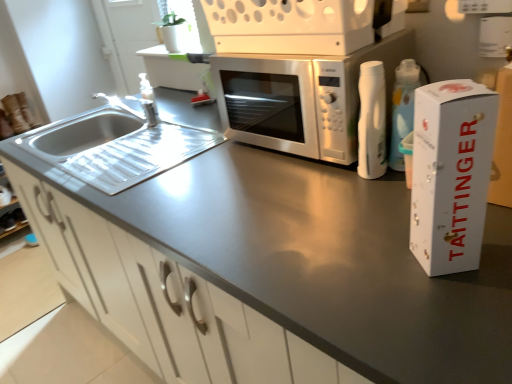
Question: Based on their sizes in the image, would you say satin silver microwave at center is bigger or smaller than satin silver microwave at center?

Choices:
 (A) big
 (B) small

Answer: (B)

Question: Considering the positions of satin silver microwave at center and satin silver microwave at center in the image, is satin silver microwave at center wider or thinner than satin silver microwave at center?

Choices:
 (A) thin
 (B) wide

Answer: (B)

Question: Which is nearer to the satin silver microwave at center?

Choices:
 (A) white matte cabinet at center
 (B) satin silver microwave at center
 (C) white cardboard box at right
 (D) stainless steel sink at left

Answer: (B)

Question: Estimate the real-world distances between objects in this image. Which object is farther from the stainless steel sink at left?

Choices:
 (A) satin silver microwave at center
 (B) white cardboard box at right
 (C) satin silver microwave at center
 (D) white matte cabinet at center

Answer: (B)